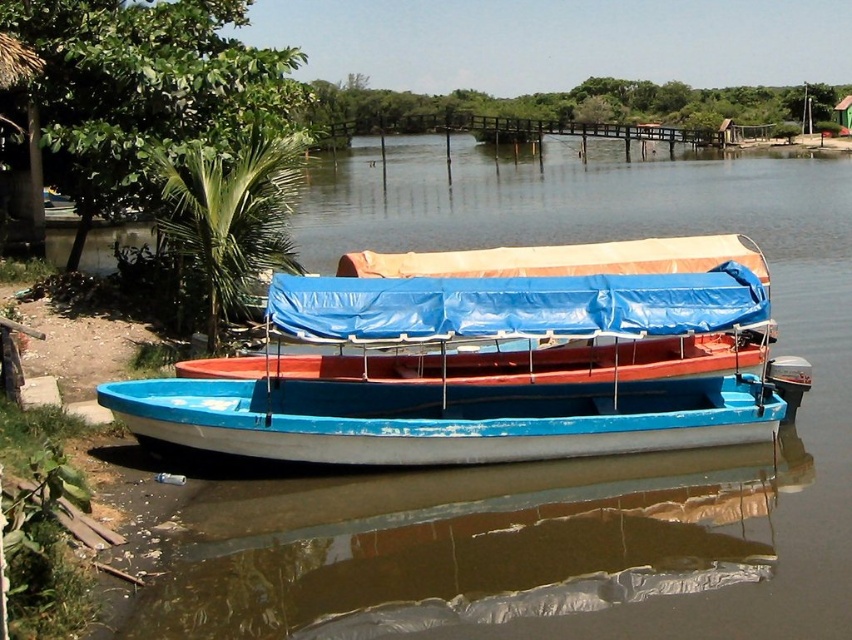
Question: Observing the image, what is the correct spatial positioning of blue plastic boat at center in reference to blue painted wood canoe at center?

Choices:
 (A) left
 (B) right

Answer: (B)

Question: Which object is farther from the camera taking this photo?

Choices:
 (A) blue plastic boat at center
 (B) blue painted wood canoe at center

Answer: (A)

Question: Does blue plastic boat at center have a larger size compared to blue painted wood canoe at center?

Choices:
 (A) no
 (B) yes

Answer: (A)

Question: Where is blue plastic boat at center located in relation to blue painted wood canoe at center in the image?

Choices:
 (A) left
 (B) right

Answer: (B)

Question: Which point is closer to the camera taking this photo?

Choices:
 (A) (639, 340)
 (B) (614, 406)

Answer: (B)

Question: Which of the following is the closest to the observer?

Choices:
 (A) (694, 429)
 (B) (573, 448)

Answer: (B)